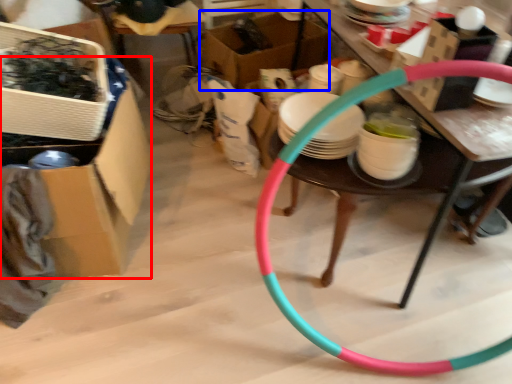
Question: Which object appears farthest to the camera in this image, box (highlighted by a red box) or box (highlighted by a blue box)?

Choices:
 (A) box
 (B) box

Answer: (B)